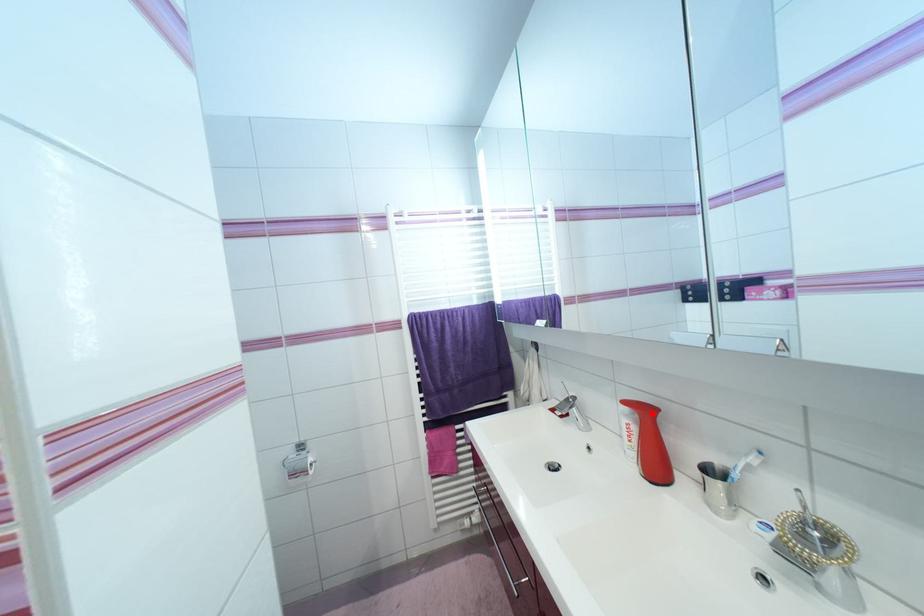
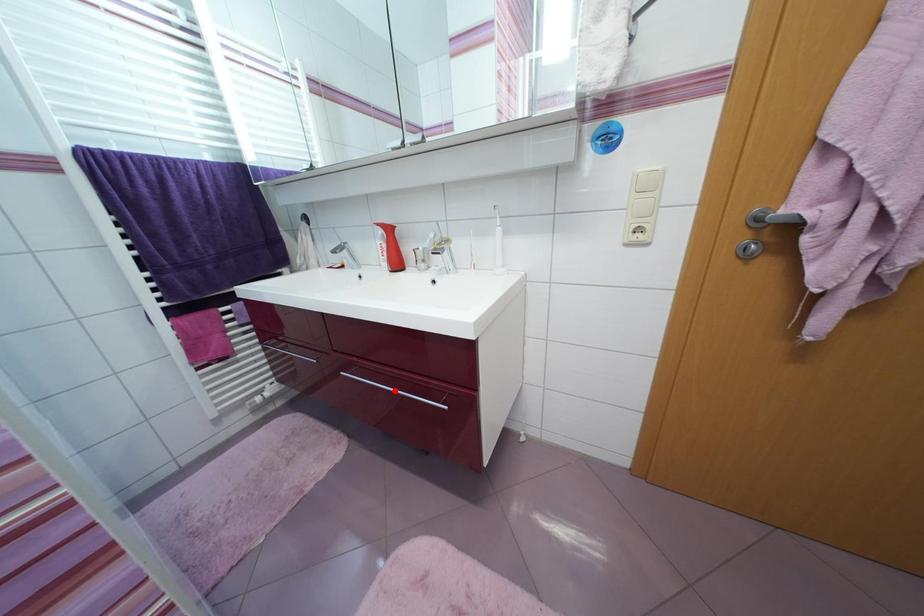
I am providing you with two images of the same scene from different viewpoints. A red point is marked on the first image and another point is marked on the second image. Does the point marked in image1 correspond to the same location as the one in image2?

No